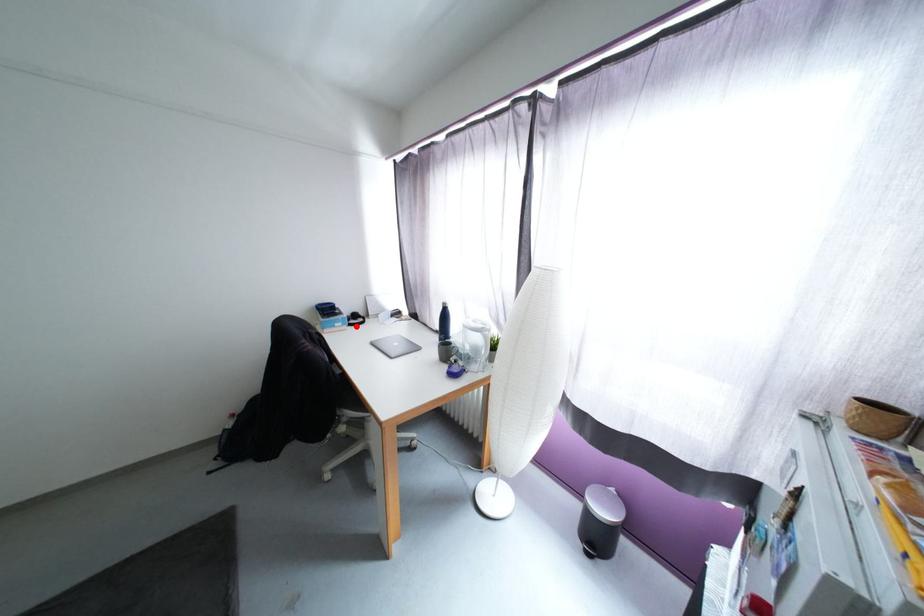
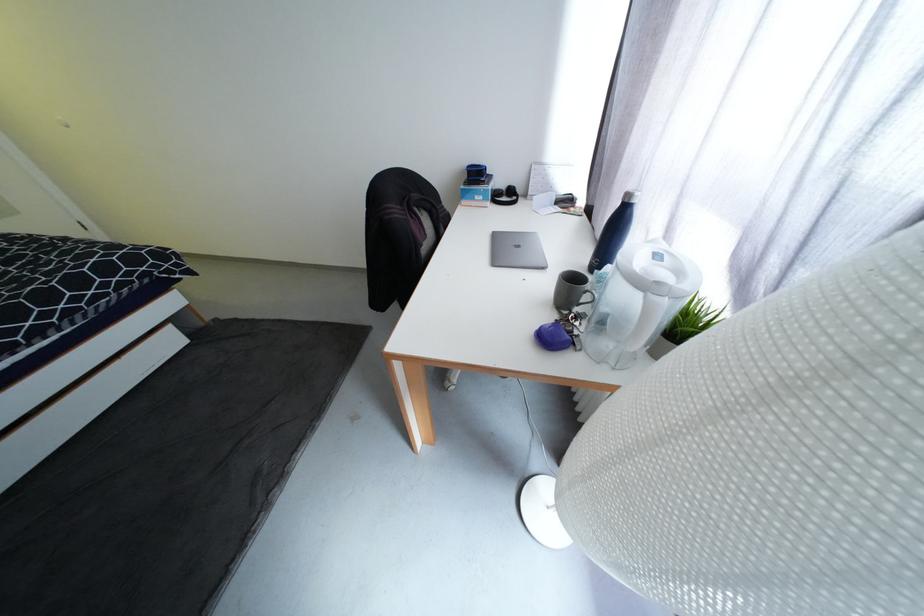
Where in the second image is the point corresponding to the highlighted location from the first image?

(499, 203)